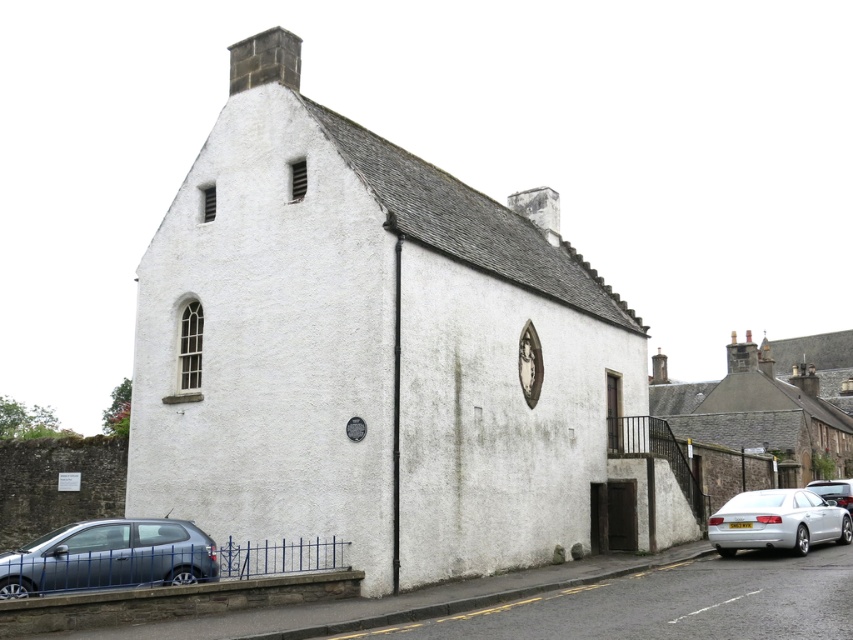
Question: Is metallic gray hatchback at lower left below silver metallic car at lower right?

Choices:
 (A) no
 (B) yes

Answer: (A)

Question: Estimate the real-world distances between objects in this image. Which object is farther from the silver metallic sedan at lower right?

Choices:
 (A) metallic gray hatchback at lower left
 (B) silver metallic car at lower right

Answer: (A)

Question: Can you confirm if metallic gray hatchback at lower left is bigger than silver metallic sedan at lower right?

Choices:
 (A) yes
 (B) no

Answer: (B)

Question: Can you confirm if silver metallic sedan at lower right is thinner than silver metallic car at lower right?

Choices:
 (A) no
 (B) yes

Answer: (A)

Question: Which is nearer to the metallic gray hatchback at lower left?

Choices:
 (A) silver metallic car at lower right
 (B) silver metallic sedan at lower right

Answer: (B)

Question: Which of the following is the closest to the observer?

Choices:
 (A) (125, 544)
 (B) (778, 502)

Answer: (A)